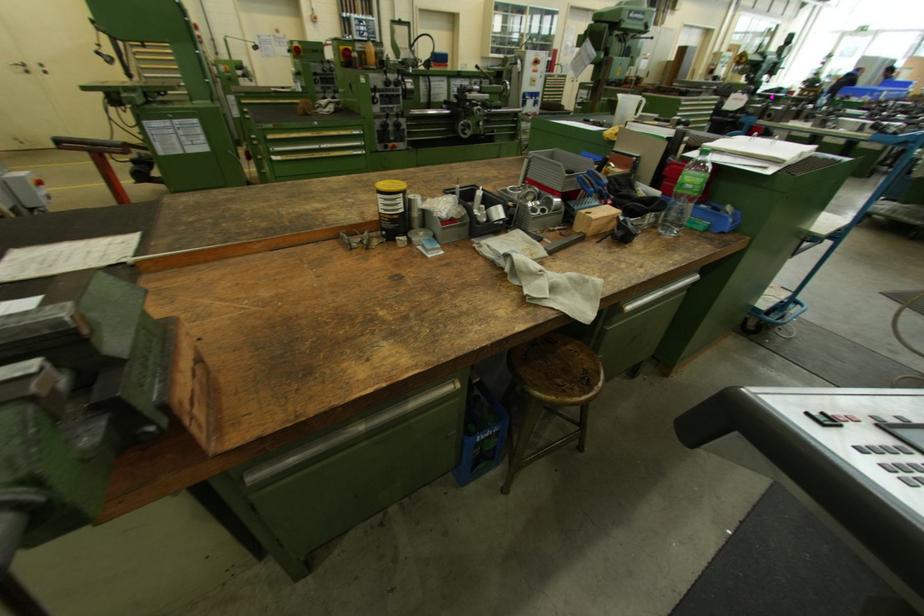
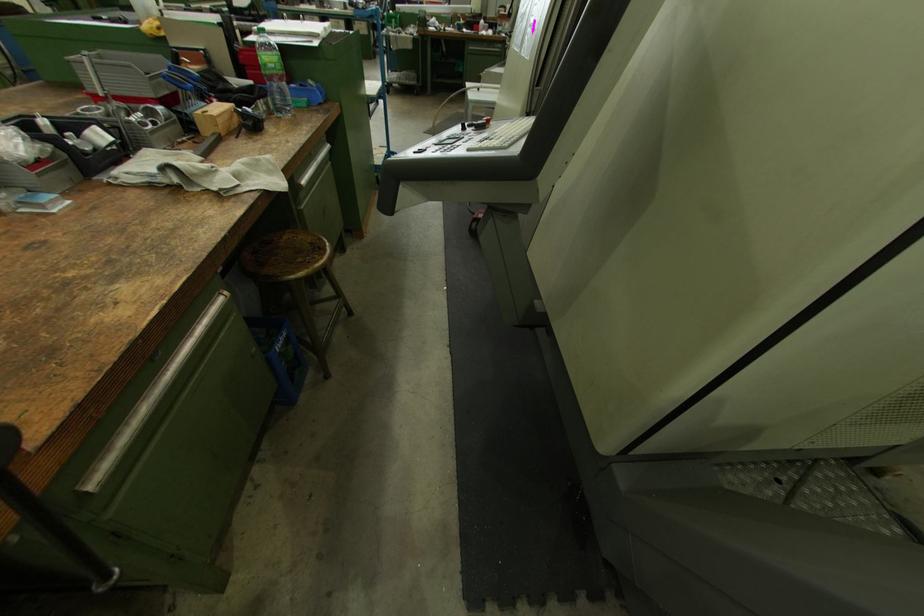
Locate, in the second image, the point that corresponds to (591,371) in the first image.

(317, 244)